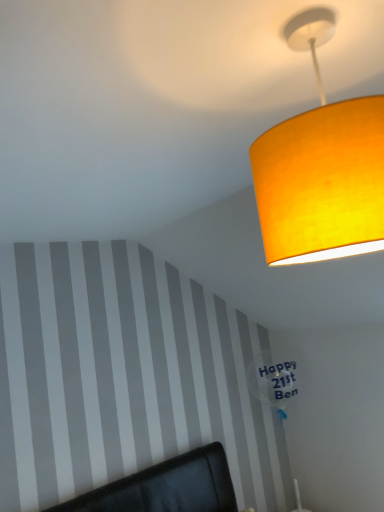
Find the location of a particular element. This screenshot has height=512, width=384. orange fabric lampshade at upper right is located at coordinates (321, 168).

This screenshot has height=512, width=384. Describe the element at coordinates (321, 168) in the screenshot. I see `orange fabric lampshade at upper right` at that location.

Locate an element on the screen. This screenshot has width=384, height=512. orange fabric lampshade at upper right is located at coordinates (321, 168).